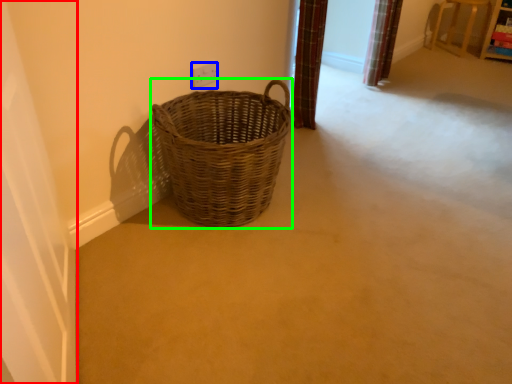
Question: Which object is the closest to the screen door (highlighted by a red box)? Choose among these: electric outlet (highlighted by a blue box) or picnic basket (highlighted by a green box).

Choices:
 (A) electric outlet
 (B) picnic basket

Answer: (B)